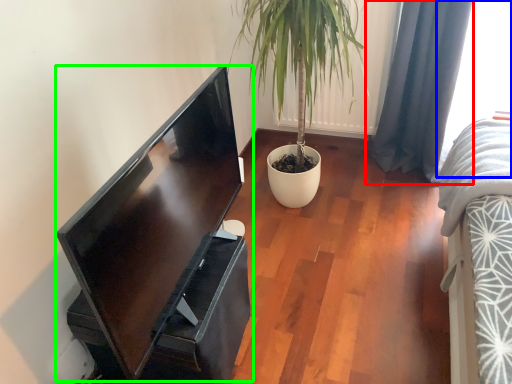
Question: Which is farther away from curtain (highlighted by a red box)? window (highlighted by a blue box) or computer monitor (highlighted by a green box)?

Choices:
 (A) window
 (B) computer monitor

Answer: (B)